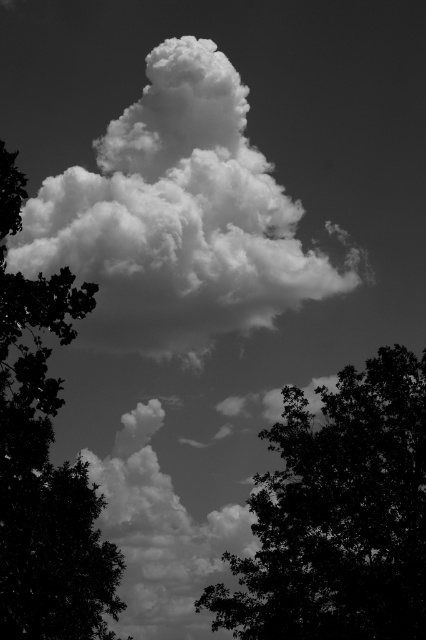
Question: Which point is farther from the camera taking this photo?

Choices:
 (A) 101,150
 (B) 40,452

Answer: (A)

Question: Which point is farther to the camera?

Choices:
 (A) silhouette leafy tree at center
 (B) white fluffy cloud at center

Answer: (B)

Question: Can you confirm if white fluffy cloud at center is positioned below silhouette leafy tree at left?

Choices:
 (A) yes
 (B) no

Answer: (B)

Question: Does white fluffy cloud at center appear over silhouette leafy tree at left?

Choices:
 (A) yes
 (B) no

Answer: (A)

Question: Based on their relative distances, which object is farther from the silhouette leafy tree at left?

Choices:
 (A) white fluffy cloud at center
 (B) silhouette leafy tree at center

Answer: (B)

Question: Does silhouette leafy tree at center appear under silhouette leafy tree at left?

Choices:
 (A) yes
 (B) no

Answer: (A)